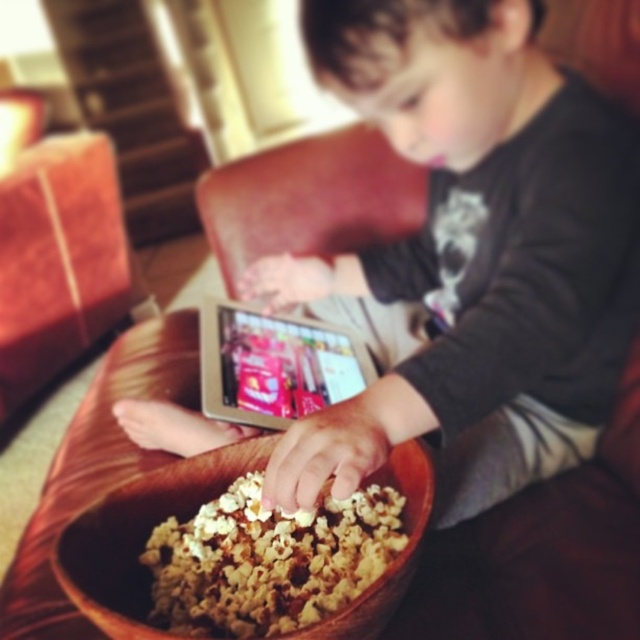
Which is more to the right, brown textured shirt at center or silver metallic tablet at center?

brown textured shirt at center

Measure the distance between brown textured shirt at center and camera.

They are 19.84 inches apart.

Locate an element on the screen. The height and width of the screenshot is (640, 640). brown textured shirt at center is located at coordinates (472, 253).

Which is below, crispy brown popcorn at lower center or silver metallic tablet at center?

Positioned lower is crispy brown popcorn at lower center.

Does crispy brown popcorn at lower center have a lesser height compared to silver metallic tablet at center?

Indeed, crispy brown popcorn at lower center has a lesser height compared to silver metallic tablet at center.

Describe the element at coordinates (268, 561) in the screenshot. I see `crispy brown popcorn at lower center` at that location.

Image resolution: width=640 pixels, height=640 pixels. What are the coordinates of `crispy brown popcorn at lower center` in the screenshot? It's located at (268, 561).

Between brown textured shirt at center and crispy brown popcorn at lower center, which one is positioned lower?

Positioned lower is crispy brown popcorn at lower center.

Does brown textured shirt at center lie in front of crispy brown popcorn at lower center?

No, brown textured shirt at center is behind crispy brown popcorn at lower center.

At what (x,y) coordinates should I click in order to perform the action: click on brown textured shirt at center. Please return your answer as a coordinate pair (x, y). This screenshot has height=640, width=640. Looking at the image, I should click on (472, 253).